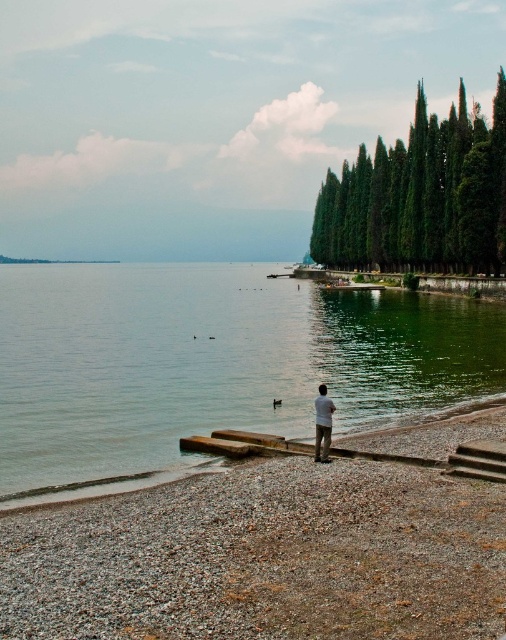
Can you confirm if green smooth water at center is wider than gravelly sand beach at lower center?

Yes, green smooth water at center is wider than gravelly sand beach at lower center.

The image size is (506, 640). In order to click on green smooth water at center in this screenshot , I will do `click(214, 364)`.

Identify the location of green smooth water at center. (214, 364).

Can you confirm if green smooth water at center is shorter than light brown fabric pants at center?

No.

The height and width of the screenshot is (640, 506). Describe the element at coordinates (214, 364) in the screenshot. I see `green smooth water at center` at that location.

Image resolution: width=506 pixels, height=640 pixels. I want to click on green smooth water at center, so click(x=214, y=364).

Is green textured cypress trees at upper right shorter than brown wooden dock at lower center?

No, green textured cypress trees at upper right is not shorter than brown wooden dock at lower center.

Which is above, green textured cypress trees at upper right or brown wooden dock at lower center?

green textured cypress trees at upper right is higher up.

Between point (471, 193) and point (458, 461), which one is positioned behind?

The point (471, 193) is more distant.

At what (x,y) coordinates should I click in order to perform the action: click on green textured cypress trees at upper right. Please return your answer as a coordinate pair (x, y). The width and height of the screenshot is (506, 640). Looking at the image, I should click on (420, 196).